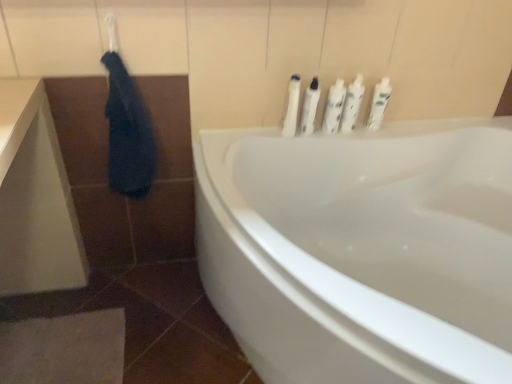
Question: Is dark blue fabric at upper left directly adjacent to white glossy bottles at upper right, the first toiletry viewed from the right?

Choices:
 (A) yes
 (B) no

Answer: (B)

Question: Is dark blue fabric at upper left closer to camera compared to white glossy bottles at upper right, the fifth toiletry from the left?

Choices:
 (A) yes
 (B) no

Answer: (A)

Question: From a real-world perspective, is dark blue fabric at upper left positioned under white glossy bottles at upper right, the fifth toiletry from the left, based on gravity?

Choices:
 (A) yes
 (B) no

Answer: (A)

Question: Does dark blue fabric at upper left have a greater height compared to white glossy bottles at upper right, the first toiletry viewed from the right?

Choices:
 (A) no
 (B) yes

Answer: (B)

Question: Is white glossy bottles at upper right, the fifth toiletry from the left, inside dark blue fabric at upper left?

Choices:
 (A) yes
 (B) no

Answer: (B)

Question: Is dark blue fabric at upper left to the left of white glossy bottles at upper right, the first toiletry viewed from the right, from the viewer's perspective?

Choices:
 (A) no
 (B) yes

Answer: (B)

Question: Does white glossy bottles at upper center, arranged as the fourth toiletry when viewed from the right, have a larger size compared to white glossy bathtub at center?

Choices:
 (A) no
 (B) yes

Answer: (A)

Question: Does white glossy bottles at upper center, arranged as the second toiletry when viewed from the left, lie in front of white glossy bathtub at center?

Choices:
 (A) no
 (B) yes

Answer: (A)

Question: From a real-world perspective, is white glossy bottles at upper center, arranged as the second toiletry when viewed from the left, over white glossy bathtub at center?

Choices:
 (A) no
 (B) yes

Answer: (B)

Question: Does white glossy bottles at upper center, arranged as the fourth toiletry when viewed from the right, appear on the right side of white glossy bathtub at center?

Choices:
 (A) yes
 (B) no

Answer: (B)

Question: Is white glossy bottles at upper center, arranged as the second toiletry when viewed from the left, at the left side of white glossy bathtub at center?

Choices:
 (A) yes
 (B) no

Answer: (A)

Question: Is white glossy bottles at upper center, arranged as the second toiletry when viewed from the left, touching white glossy bathtub at center?

Choices:
 (A) yes
 (B) no

Answer: (B)

Question: Considering the relative positions of white glossy bottles at upper right, the first toiletry viewed from the right, and white glossy bottles at upper center, arranged as the second toiletry when viewed from the left, in the image provided, is white glossy bottles at upper right, the first toiletry viewed from the right, behind white glossy bottles at upper center, arranged as the second toiletry when viewed from the left,?

Choices:
 (A) no
 (B) yes

Answer: (B)